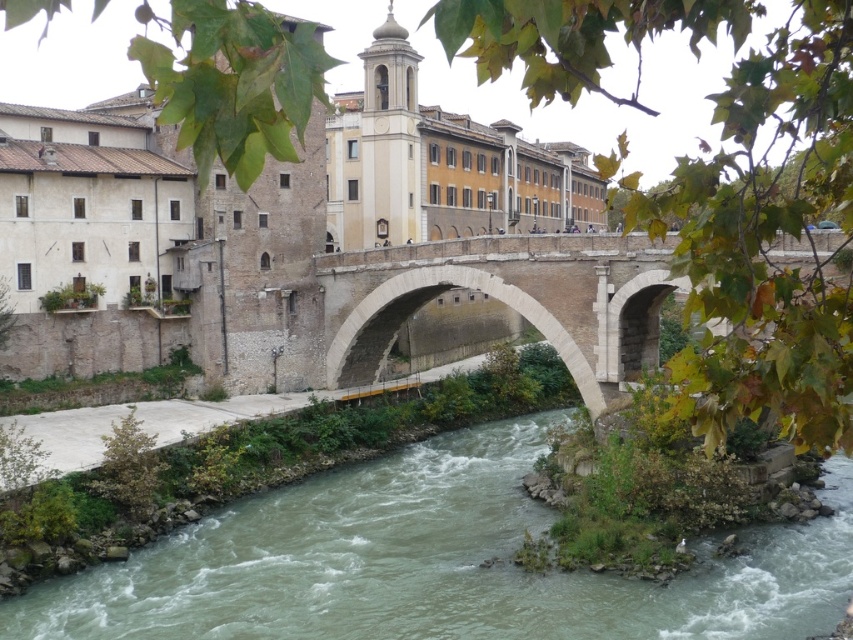
You are standing at the historic stone bridge and want to take a photo of the two points marked in the image. Which point, point (18, 618) or point (650, 339), is closer to you?

Point (18, 618) is in front of point (650, 339), so it is closer to you.

You are a tourist standing on the stone arch bridge at center. You want to take a photo of the brown sedimentary rock river at lower center. Which direction should you face to capture the river in the foreground and the bridge in the background?

Since the stone arch bridge at center is behind the brown sedimentary rock river at lower center, you should face towards the river to have it in the foreground with the bridge visible behind it.

You are a tourist standing on the stone arch bridge at center. Looking down, you notice the brown sedimentary rock river at lower center. Which structure appears taller from your vantage point?

The stone arch bridge at center appears taller because it has a greater height than the brown sedimentary rock river at lower center.